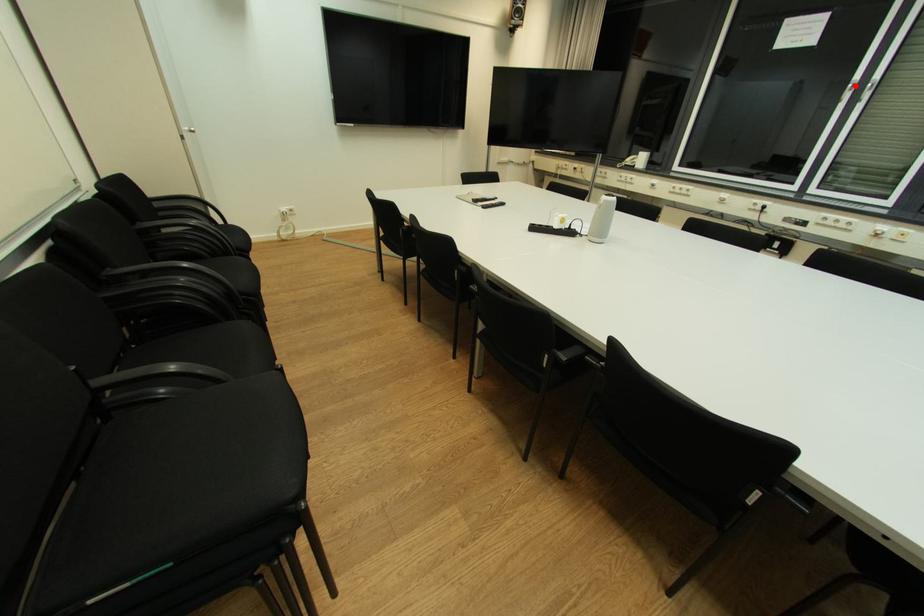
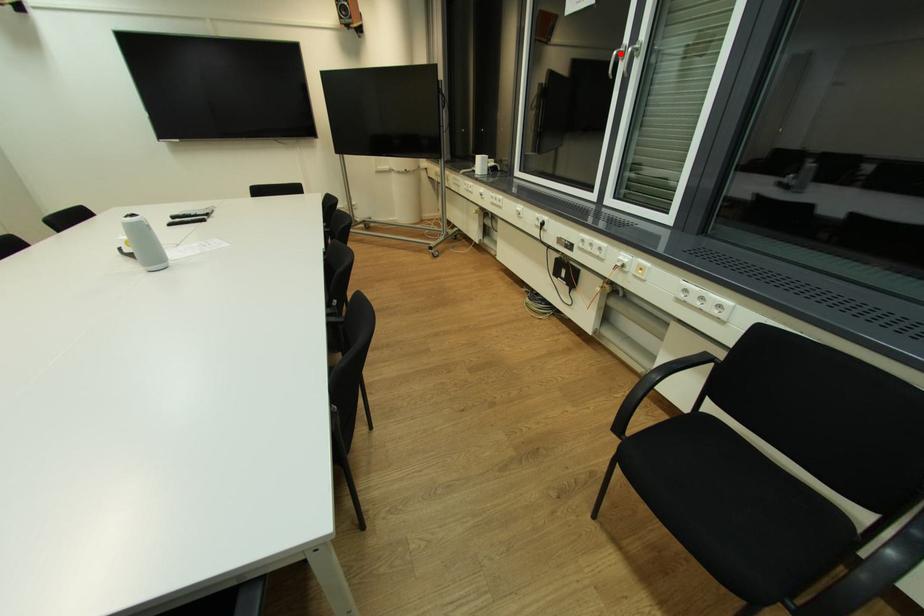
I am providing you with two images of the same scene from different viewpoints. A red point is marked on the first image and another point is marked on the second image. Does the point marked in image1 correspond to the same location as the one in image2?

Yes